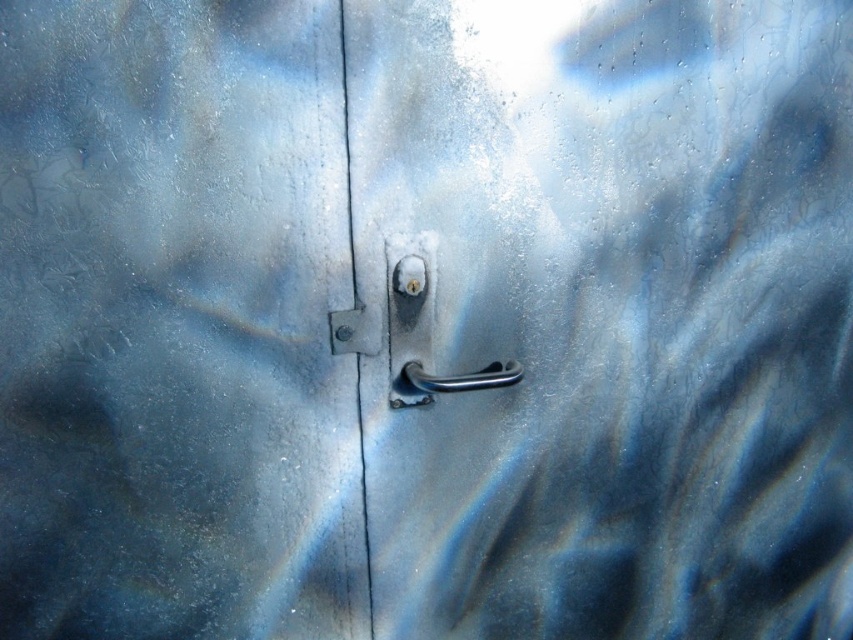
Based on the scene description, where exactly is the metallic silver handle at center located?

The metallic silver handle at center is located at point coordinates of (606, 314).

You are a maintenance worker standing 1 meter away from the door. You need to reach the satin silver handle at center to fix it. Can you comfortably reach it without moving closer?

The satin silver handle at center is 1.16 meters away from the viewer. Since you are standing 1 meter away, you are 0.16 meters too far to comfortably reach it without moving closer.

You are trying to open a door and see two handles at the center. Which handle is on top, the metallic silver handle at center or the polished metal handle at center?

The metallic silver handle at center is positioned over the polished metal handle at center, so it is on top.